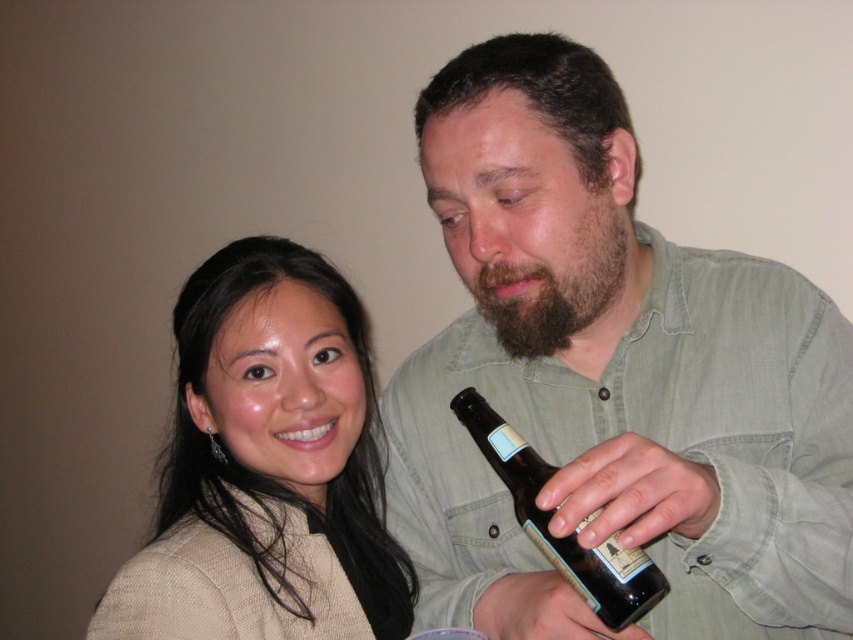
Question: Can you confirm if brown matte bottle at center is smaller than matte beige sweater at upper left?

Choices:
 (A) no
 (B) yes

Answer: (A)

Question: In this image, where is brown matte bottle at center located relative to brown fuzzy beard at center?

Choices:
 (A) right
 (B) left

Answer: (B)

Question: Does brown fuzzy beard at center have a lesser width compared to brown glass bottle at center?

Choices:
 (A) yes
 (B) no

Answer: (B)

Question: Which point is closer to the camera?

Choices:
 (A) brown fuzzy beard at center
 (B) brown matte bottle at center
 (C) brown glass bottle at center

Answer: (B)

Question: Based on their relative distances, which object is farther from the brown glass bottle at center?

Choices:
 (A) brown fuzzy beard at center
 (B) matte beige sweater at upper left
 (C) brown matte bottle at center

Answer: (B)

Question: Which object is the closest to the brown glass bottle at center?

Choices:
 (A) brown fuzzy beard at center
 (B) brown matte bottle at center
 (C) matte beige sweater at upper left

Answer: (A)